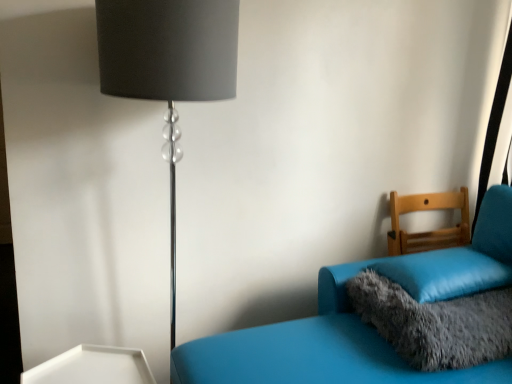
Image resolution: width=512 pixels, height=384 pixels. Find the location of `black metallic lamp at left`. black metallic lamp at left is located at coordinates (168, 67).

What do you see at coordinates (428, 231) in the screenshot? Image resolution: width=512 pixels, height=384 pixels. I see `light brown wooden chair at right, which ranks as the 1th furniture in back-to-front order` at bounding box center [428, 231].

This screenshot has height=384, width=512. In order to click on fluffy gray pillow at lower right, the 1th pillow when ordered from bottom to top in this screenshot , I will do `click(435, 323)`.

You are a GUI agent. You are given a task and a screenshot of the screen. Output one action in this format:
    pyautogui.click(x=<x>, y=<y>)
    Task: Click on the soft blue pillow at right, the first pillow viewed from the top
    
    Given the screenshot: What is the action you would take?
    pyautogui.click(x=444, y=273)

Is matte blue couch at right, which is the first furniture in front-to-back order, far away from black metallic lamp at left?

No, matte blue couch at right, which is the first furniture in front-to-back order, is not far away from black metallic lamp at left.

Is matte blue couch at right, acting as the second furniture starting from the back, inside or outside of black metallic lamp at left?

matte blue couch at right, acting as the second furniture starting from the back, exists outside the volume of black metallic lamp at left.

Which object is closer to the camera, matte blue couch at right, acting as the second furniture starting from the back, or black metallic lamp at left?

matte blue couch at right, acting as the second furniture starting from the back, is more forward.

Between matte blue couch at right, acting as the second furniture starting from the back, and black metallic lamp at left, which one has more height?

black metallic lamp at left is taller.

Which object is thinner, matte blue couch at right, which is the first furniture in front-to-back order, or fluffy gray pillow at lower right, the 1th pillow when ordered from bottom to top?

Thinner between the two is fluffy gray pillow at lower right, the 1th pillow when ordered from bottom to top.

Which object is positioned more to the left, matte blue couch at right, which is the first furniture in front-to-back order, or fluffy gray pillow at lower right, which is the second pillow from top to bottom?

Positioned to the left is matte blue couch at right, which is the first furniture in front-to-back order.

Which of these two, matte blue couch at right, acting as the second furniture starting from the back, or fluffy gray pillow at lower right, the 1th pillow when ordered from bottom to top, stands shorter?

fluffy gray pillow at lower right, the 1th pillow when ordered from bottom to top.

Would you say fluffy gray pillow at lower right, the 1th pillow when ordered from bottom to top, is part of matte blue couch at right, which is the first furniture in front-to-back order,'s contents?

Yes, matte blue couch at right, which is the first furniture in front-to-back order, is surrounding fluffy gray pillow at lower right, the 1th pillow when ordered from bottom to top.

Does point (435, 336) come farther from viewer compared to point (467, 251)?

No, (435, 336) is in front of (467, 251).

From a real-world perspective, is fluffy gray pillow at lower right, which is the second pillow from top to bottom, below soft blue pillow at right, marked as the second pillow in a bottom-to-top arrangement?

Yes, from a real-world perspective, fluffy gray pillow at lower right, which is the second pillow from top to bottom, is under soft blue pillow at right, marked as the second pillow in a bottom-to-top arrangement.

Is fluffy gray pillow at lower right, the 1th pillow when ordered from bottom to top, at the left side of soft blue pillow at right, marked as the second pillow in a bottom-to-top arrangement?

Correct, you'll find fluffy gray pillow at lower right, the 1th pillow when ordered from bottom to top, to the left of soft blue pillow at right, marked as the second pillow in a bottom-to-top arrangement.

How much distance is there between fluffy gray pillow at lower right, the 1th pillow when ordered from bottom to top, and soft blue pillow at right, marked as the second pillow in a bottom-to-top arrangement?

The distance of fluffy gray pillow at lower right, the 1th pillow when ordered from bottom to top, from soft blue pillow at right, marked as the second pillow in a bottom-to-top arrangement, is 4.10 inches.

From a real-world perspective, count 2nd pillows downward from the black metallic lamp at left and point to it. Please provide its 2D coordinates.

[(435, 323)]

From the image's perspective, is black metallic lamp at left located above or below fluffy gray pillow at lower right, the 1th pillow when ordered from bottom to top?

black metallic lamp at left is above fluffy gray pillow at lower right, the 1th pillow when ordered from bottom to top.

Is black metallic lamp at left placed right next to fluffy gray pillow at lower right, which is the second pillow from top to bottom?

black metallic lamp at left is not next to fluffy gray pillow at lower right, which is the second pillow from top to bottom, and they're not touching.

From a real-world perspective, which object rests below the other?

fluffy gray pillow at lower right, which is the second pillow from top to bottom, is physically lower.

Which is behind, light brown wooden chair at right, the second furniture from the front, or soft blue pillow at right, marked as the second pillow in a bottom-to-top arrangement?

Positioned behind is light brown wooden chair at right, the second furniture from the front.

From a real-world perspective, between light brown wooden chair at right, the second furniture from the front, and soft blue pillow at right, marked as the second pillow in a bottom-to-top arrangement, who is vertically higher?

From a 3D spatial view, light brown wooden chair at right, the second furniture from the front, is above.

Is light brown wooden chair at right, which ranks as the 1th furniture in back-to-front order, positioned far away from soft blue pillow at right, the first pillow viewed from the top?

They are positioned close to each other.

Between soft blue pillow at right, marked as the second pillow in a bottom-to-top arrangement, and black metallic lamp at left, which one is positioned behind?

Positioned behind is soft blue pillow at right, marked as the second pillow in a bottom-to-top arrangement.

Is soft blue pillow at right, the first pillow viewed from the top, facing towards black metallic lamp at left?

Yes, soft blue pillow at right, the first pillow viewed from the top, is aimed at black metallic lamp at left.

Considering the relative sizes of soft blue pillow at right, marked as the second pillow in a bottom-to-top arrangement, and black metallic lamp at left in the image provided, is soft blue pillow at right, marked as the second pillow in a bottom-to-top arrangement, taller than black metallic lamp at left?

No, soft blue pillow at right, marked as the second pillow in a bottom-to-top arrangement, is not taller than black metallic lamp at left.

In the scene shown: From the image's perspective, is soft blue pillow at right, the first pillow viewed from the top, positioned above or below light brown wooden chair at right, the second furniture from the front?

Based on their image positions, soft blue pillow at right, the first pillow viewed from the top, is located beneath light brown wooden chair at right, the second furniture from the front.

Would you consider soft blue pillow at right, the first pillow viewed from the top, to be distant from light brown wooden chair at right, the second furniture from the front?

No.

From a real-world perspective, is soft blue pillow at right, the first pillow viewed from the top, positioned under light brown wooden chair at right, which ranks as the 1th furniture in back-to-front order, based on gravity?

Yes, from a real-world perspective, soft blue pillow at right, the first pillow viewed from the top, is beneath light brown wooden chair at right, which ranks as the 1th furniture in back-to-front order.

Is soft blue pillow at right, marked as the second pillow in a bottom-to-top arrangement, further to camera compared to light brown wooden chair at right, which ranks as the 1th furniture in back-to-front order?

No, it is not.

Where is `lamp above the matte blue couch at right, acting as the second furniture starting from the back (from the image's perspective)`? Image resolution: width=512 pixels, height=384 pixels. lamp above the matte blue couch at right, acting as the second furniture starting from the back (from the image's perspective) is located at coordinates (168, 67).

This screenshot has width=512, height=384. Find the location of `furniture in front of the fluffy gray pillow at lower right, which is the second pillow from top to bottom`. furniture in front of the fluffy gray pillow at lower right, which is the second pillow from top to bottom is located at coordinates (361, 321).

Looking at the image, which one is located closer to matte blue couch at right, which is the first furniture in front-to-back order, fluffy gray pillow at lower right, the 1th pillow when ordered from bottom to top, or light brown wooden chair at right, the second furniture from the front?

Among the two, fluffy gray pillow at lower right, the 1th pillow when ordered from bottom to top, is located nearer to matte blue couch at right, which is the first furniture in front-to-back order.

Which object lies further to the anchor point soft blue pillow at right, the first pillow viewed from the top, fluffy gray pillow at lower right, the 1th pillow when ordered from bottom to top, or black metallic lamp at left?

Among the two, black metallic lamp at left is located further to soft blue pillow at right, the first pillow viewed from the top.

Which object lies nearer to the anchor point black metallic lamp at left, light brown wooden chair at right, the second furniture from the front, or fluffy gray pillow at lower right, the 1th pillow when ordered from bottom to top?

Based on the image, fluffy gray pillow at lower right, the 1th pillow when ordered from bottom to top, appears to be nearer to black metallic lamp at left.

From the image, which object appears to be farther from light brown wooden chair at right, the second furniture from the front, matte blue couch at right, acting as the second furniture starting from the back, or soft blue pillow at right, marked as the second pillow in a bottom-to-top arrangement?

The object further to light brown wooden chair at right, the second furniture from the front, is matte blue couch at right, acting as the second furniture starting from the back.

From the image, which object appears to be farther from light brown wooden chair at right, which ranks as the 1th furniture in back-to-front order, soft blue pillow at right, the first pillow viewed from the top, or black metallic lamp at left?

Based on the image, black metallic lamp at left appears to be further to light brown wooden chair at right, which ranks as the 1th furniture in back-to-front order.

From the image, which object appears to be farther from fluffy gray pillow at lower right, which is the second pillow from top to bottom, black metallic lamp at left or matte blue couch at right, acting as the second furniture starting from the back?

black metallic lamp at left is further to fluffy gray pillow at lower right, which is the second pillow from top to bottom.

Looking at this image, estimate the real-world distances between objects in this image. Which object is closer to matte blue couch at right, which is the first furniture in front-to-back order, soft blue pillow at right, the first pillow viewed from the top, or black metallic lamp at left?

Based on the image, soft blue pillow at right, the first pillow viewed from the top, appears to be nearer to matte blue couch at right, which is the first furniture in front-to-back order.

Estimate the real-world distances between objects in this image. Which object is closer to fluffy gray pillow at lower right, the 1th pillow when ordered from bottom to top, light brown wooden chair at right, the second furniture from the front, or black metallic lamp at left?

Among the two, light brown wooden chair at right, the second furniture from the front, is located nearer to fluffy gray pillow at lower right, the 1th pillow when ordered from bottom to top.

At what (x,y) coordinates should I click in order to perform the action: click on furniture between black metallic lamp at left and fluffy gray pillow at lower right, which is the second pillow from top to bottom. Please return your answer as a coordinate pair (x, y). The height and width of the screenshot is (384, 512). Looking at the image, I should click on (361, 321).

Where is `pillow between fluffy gray pillow at lower right, which is the second pillow from top to bottom, and light brown wooden chair at right, which ranks as the 1th furniture in back-to-front order, from front to back`? Image resolution: width=512 pixels, height=384 pixels. pillow between fluffy gray pillow at lower right, which is the second pillow from top to bottom, and light brown wooden chair at right, which ranks as the 1th furniture in back-to-front order, from front to back is located at coordinates (444, 273).

You are a GUI agent. You are given a task and a screenshot of the screen. Output one action in this format:
    pyautogui.click(x=<x>, y=<y>)
    Task: Click on the furniture between black metallic lamp at left and soft blue pillow at right, marked as the second pillow in a bottom-to-top arrangement
    
    Given the screenshot: What is the action you would take?
    pyautogui.click(x=361, y=321)

At what (x,y) coordinates should I click in order to perform the action: click on lamp between matte blue couch at right, which is the first furniture in front-to-back order, and light brown wooden chair at right, which ranks as the 1th furniture in back-to-front order, in the front-back direction. Please return your answer as a coordinate pair (x, y). This screenshot has width=512, height=384. Looking at the image, I should click on (168, 67).